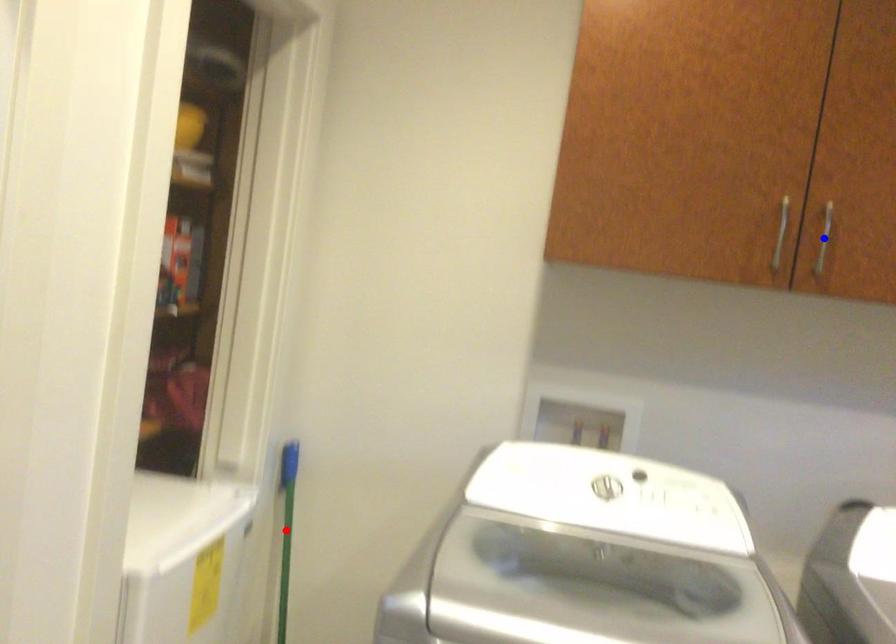
Question: In the image, two points are highlighted. Which point is nearer to the camera? Reply with the corresponding letter.

Choices:
 (A) blue point
 (B) red point

Answer: (A)